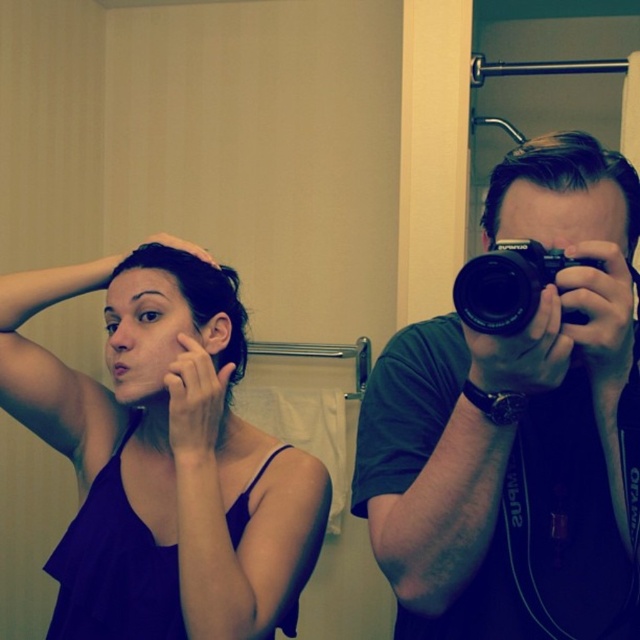
Between point (531, 369) and point (230, 339), which one is positioned in front?

Point (531, 369)

Where is `black matte camera at right`? The width and height of the screenshot is (640, 640). black matte camera at right is located at coordinates (516, 429).

Measure the distance from purple matte tank top at upper left to black plastic camera at center.

They are 20.35 inches apart.

This screenshot has width=640, height=640. Identify the location of purple matte tank top at upper left. [163, 458].

Locate an element on the screen. This screenshot has width=640, height=640. purple matte tank top at upper left is located at coordinates (163, 458).

Is black matte camera at right behind black plastic camera at center?

Yes, black matte camera at right is behind black plastic camera at center.

Between point (460, 576) and point (460, 292), which one is positioned behind?

The point (460, 576) is behind.

Is point (627, 252) positioned in front of point (477, 285)?

No.

Find the location of a particular element. black matte camera at right is located at coordinates (516, 429).